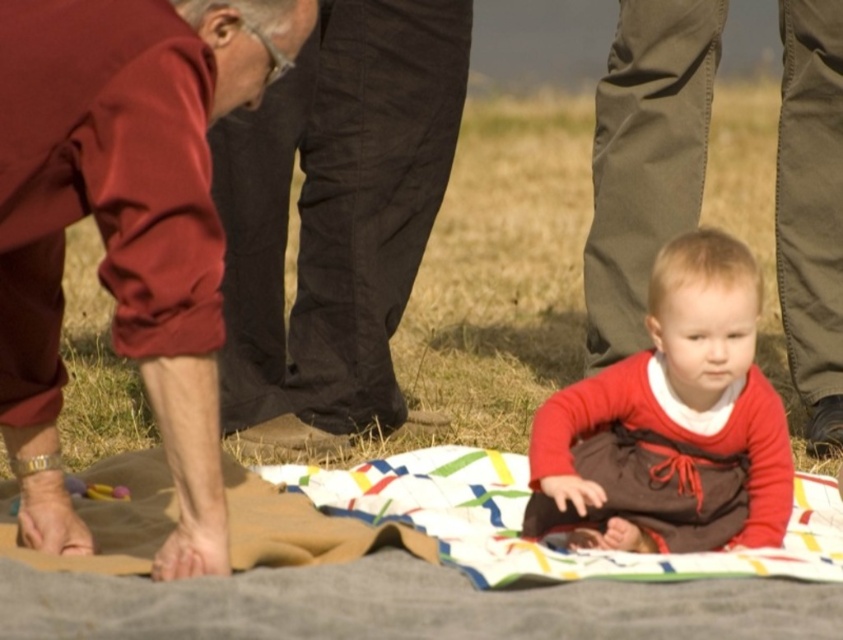
Question: Which point appears closest to the camera in this image?

Choices:
 (A) (244, 193)
 (B) (796, 88)
 (C) (685, 417)

Answer: (C)

Question: Which object appears farthest from the camera in this image?

Choices:
 (A) maroon fabric pants at lower left
 (B) red cotton shirt at center
 (C) matte red dress at center
 (D) dark brown pants at left

Answer: (B)

Question: Is dark brown pants at left closer to the viewer compared to red cotton shirt at center?

Choices:
 (A) yes
 (B) no

Answer: (A)

Question: Can you confirm if dark brown pants at left is positioned to the right of matte red dress at center?

Choices:
 (A) no
 (B) yes

Answer: (A)

Question: Can you confirm if red cotton shirt at center is positioned to the right of matte red dress at center?

Choices:
 (A) yes
 (B) no

Answer: (A)

Question: Estimate the real-world distances between objects in this image. Which object is closer to the dark brown pants at left?

Choices:
 (A) red cotton shirt at center
 (B) maroon fabric pants at lower left

Answer: (A)